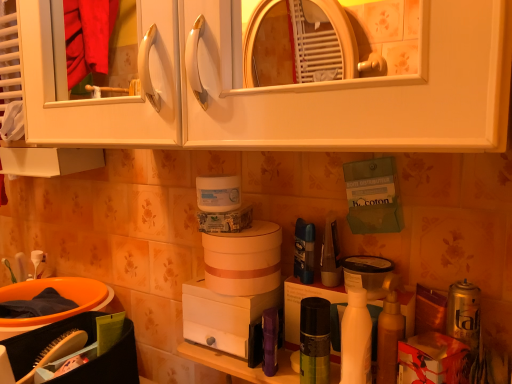
Question: Can you confirm if white matte bottle at center right is shorter than purple fabric pouch at center, which is the second toiletry from right to left?

Choices:
 (A) yes
 (B) no

Answer: (B)

Question: Does white matte bottle at center right have a lesser width compared to purple fabric pouch at center, which appears as the 1th toiletry when viewed from the left?

Choices:
 (A) yes
 (B) no

Answer: (B)

Question: Are white matte bottle at center right and purple fabric pouch at center, which appears as the 1th toiletry when viewed from the left, far apart?

Choices:
 (A) yes
 (B) no

Answer: (B)

Question: Is white matte bottle at center right behind purple fabric pouch at center, which appears as the 1th toiletry when viewed from the left?

Choices:
 (A) no
 (B) yes

Answer: (A)

Question: Considering the relative sizes of white matte bottle at center right and purple fabric pouch at center, which is the second toiletry from right to left, in the image provided, is white matte bottle at center right taller than purple fabric pouch at center, which is the second toiletry from right to left,?

Choices:
 (A) yes
 (B) no

Answer: (A)

Question: From the image's perspective, would you say white matte bottle at center right is positioned over purple fabric pouch at center, which appears as the 1th toiletry when viewed from the left?

Choices:
 (A) yes
 (B) no

Answer: (A)

Question: Are green matte spray can at center, placed as the 1th toiletry when sorted from right to left, and orange plastic basin at lower left making contact?

Choices:
 (A) yes
 (B) no

Answer: (B)

Question: From the image's perspective, is green matte spray can at center, which ranks as the 2th toiletry in left-to-right order, on top of orange plastic basin at lower left?

Choices:
 (A) no
 (B) yes

Answer: (B)

Question: Could you tell me if green matte spray can at center, placed as the 1th toiletry when sorted from right to left, is turned towards orange plastic basin at lower left?

Choices:
 (A) yes
 (B) no

Answer: (B)

Question: Does green matte spray can at center, which ranks as the 2th toiletry in left-to-right order, appear on the right side of orange plastic basin at lower left?

Choices:
 (A) yes
 (B) no

Answer: (A)

Question: From the image's perspective, is green matte spray can at center, which ranks as the 2th toiletry in left-to-right order, under orange plastic basin at lower left?

Choices:
 (A) yes
 (B) no

Answer: (B)

Question: Would you consider green matte spray can at center, which ranks as the 2th toiletry in left-to-right order, to be distant from orange plastic basin at lower left?

Choices:
 (A) yes
 (B) no

Answer: (B)

Question: Is white matte cabinet at upper center completely or partially inside green matte spray can at center, which ranks as the 2th toiletry in left-to-right order?

Choices:
 (A) no
 (B) yes

Answer: (A)